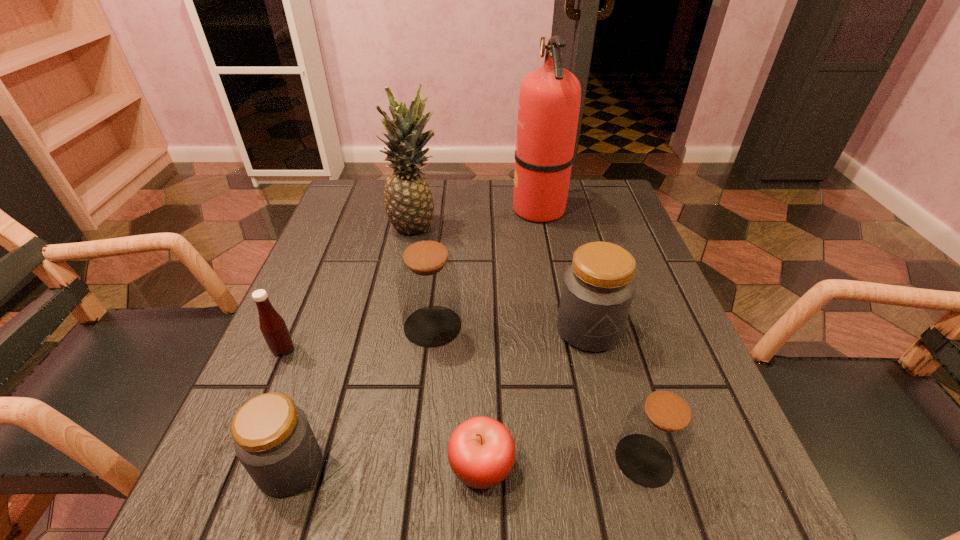
Where is `the seventh object from right to left`? This screenshot has width=960, height=540. the seventh object from right to left is located at coordinates (273, 440).

Locate an element on the screen. The width and height of the screenshot is (960, 540). the left gray jar is located at coordinates (273, 440).

You are a GUI agent. You are given a task and a screenshot of the screen. Output one action in this format:
    pyautogui.click(x=<x>, y=<y>)
    Task: Click on the right brown jar
    The height and width of the screenshot is (540, 960).
    Given the screenshot: What is the action you would take?
    pyautogui.click(x=658, y=432)

In order to click on the smaller brown jar in this screenshot , I will do `click(658, 432)`.

Where is `the shortest object`? the shortest object is located at coordinates (481, 452).

Where is `apple`? apple is located at coordinates [481, 452].

Identify the location of free space located 0.060m on the side of the fire extinguisher with the nozzle and handle. The width and height of the screenshot is (960, 540). (490, 209).

This screenshot has width=960, height=540. Find the location of `free space located 0.330m on the side of the fire extinguisher with the nozzle and handle`. free space located 0.330m on the side of the fire extinguisher with the nozzle and handle is located at coordinates (390, 209).

Where is `vacant space located 0.230m on the side of the fire extinguisher with the nozzle and handle`? The height and width of the screenshot is (540, 960). vacant space located 0.230m on the side of the fire extinguisher with the nozzle and handle is located at coordinates (426, 209).

At what (x,y) coordinates should I click in order to perform the action: click on vacant region located 0.330m on the front of the second tallest object. Please return your answer as a coordinate pair (x, y). Image resolution: width=960 pixels, height=540 pixels. Looking at the image, I should click on (392, 344).